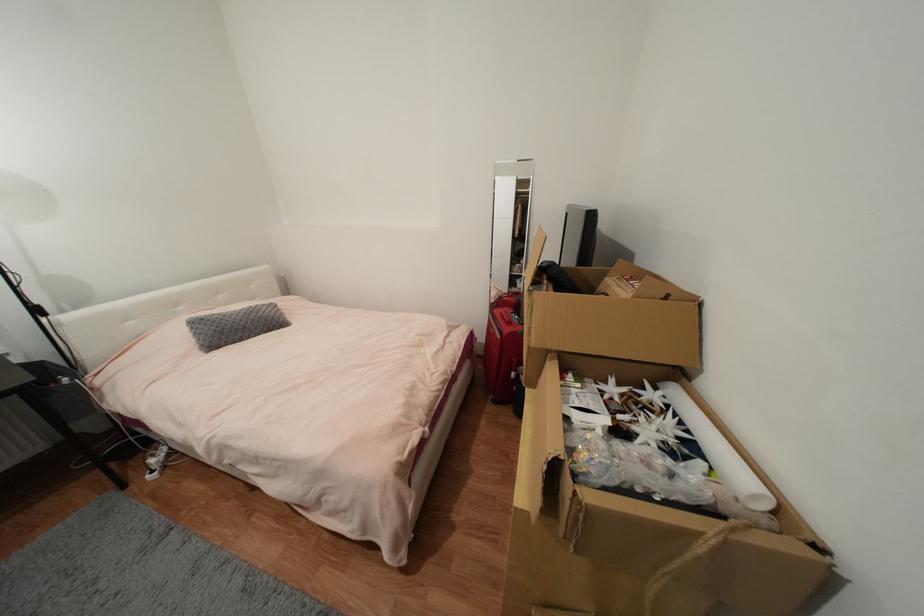
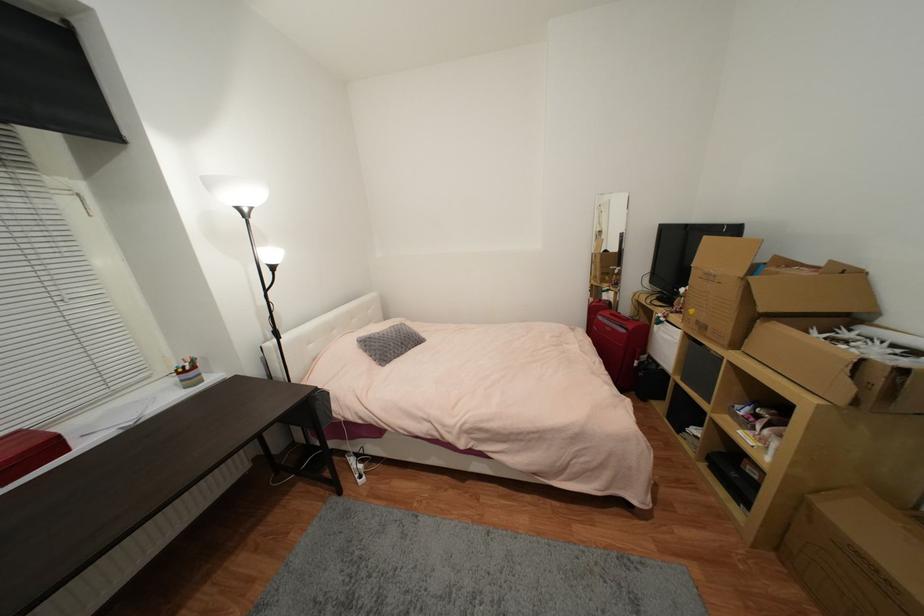
Question: In a continuous first-person perspective shot, in which direction is the camera moving?

Choices:
 (A) Left
 (B) Right
 (C) Forward
 (D) Backward

Answer: (A)